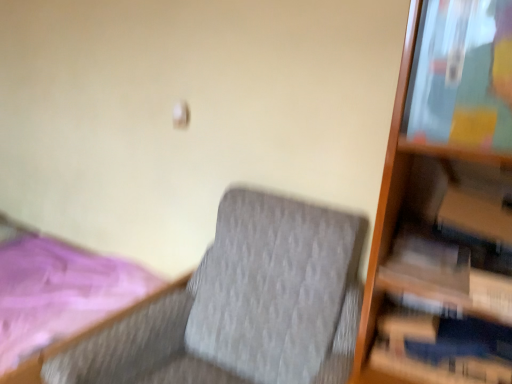
Question: Considering the relative sizes of white matte paperback book at right and pink fabric bed at lower left in the image provided, is white matte paperback book at right smaller than pink fabric bed at lower left?

Choices:
 (A) yes
 (B) no

Answer: (A)

Question: From a real-world perspective, is white matte paperback book at right positioned under pink fabric bed at lower left based on gravity?

Choices:
 (A) yes
 (B) no

Answer: (B)

Question: Is white matte paperback book at right further to the viewer compared to pink fabric bed at lower left?

Choices:
 (A) no
 (B) yes

Answer: (A)

Question: Can you confirm if white matte paperback book at right is positioned to the left of pink fabric bed at lower left?

Choices:
 (A) yes
 (B) no

Answer: (B)

Question: Is the position of white matte paperback book at right less distant than that of pink fabric bed at lower left?

Choices:
 (A) no
 (B) yes

Answer: (B)

Question: Is pink fabric bed at lower left a part of white matte paperback book at right?

Choices:
 (A) no
 (B) yes

Answer: (A)

Question: Is textured gray fabric rocking chair at center touching white matte paperback book at right?

Choices:
 (A) yes
 (B) no

Answer: (B)

Question: Could you tell me if textured gray fabric rocking chair at center is turned towards white matte paperback book at right?

Choices:
 (A) yes
 (B) no

Answer: (B)

Question: From the image's perspective, is textured gray fabric rocking chair at center over white matte paperback book at right?

Choices:
 (A) no
 (B) yes

Answer: (A)

Question: Is textured gray fabric rocking chair at center outside of white matte paperback book at right?

Choices:
 (A) no
 (B) yes

Answer: (B)

Question: From a real-world perspective, is textured gray fabric rocking chair at center over white matte paperback book at right?

Choices:
 (A) yes
 (B) no

Answer: (B)

Question: Are textured gray fabric rocking chair at center and white matte paperback book at right far apart?

Choices:
 (A) no
 (B) yes

Answer: (A)

Question: From a real-world perspective, is textured gray fabric rocking chair at center beneath pink fabric bed at lower left?

Choices:
 (A) yes
 (B) no

Answer: (B)